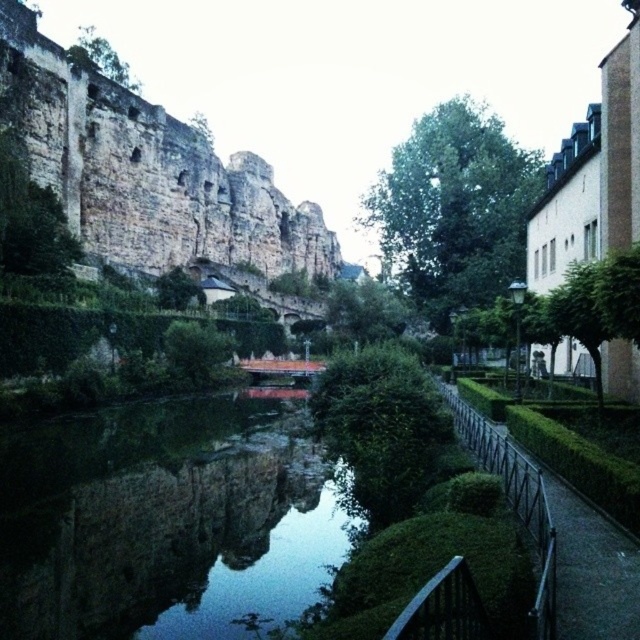
Does point (163, 404) lie behind point (179, 145)?

No, it is not.

Describe the element at coordinates (163, 522) in the screenshot. Image resolution: width=640 pixels, height=640 pixels. I see `dark reflective water at center` at that location.

You are a GUI agent. You are given a task and a screenshot of the screen. Output one action in this format:
    pyautogui.click(x=<x>, y=<y>)
    Task: Click on the dark reflective water at center
    
    Given the screenshot: What is the action you would take?
    pyautogui.click(x=163, y=522)